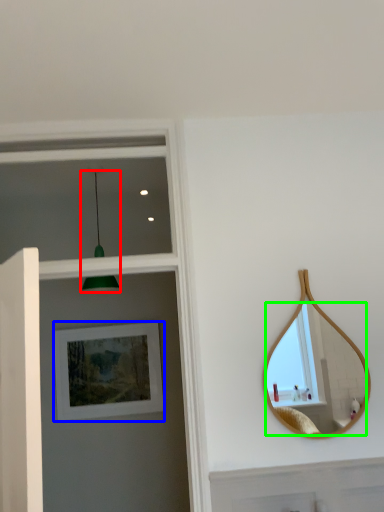
Question: Which is nearer to the light fixture (highlighted by a red box)? picture frame (highlighted by a blue box) or mirror (highlighted by a green box).

Choices:
 (A) picture frame
 (B) mirror

Answer: (A)